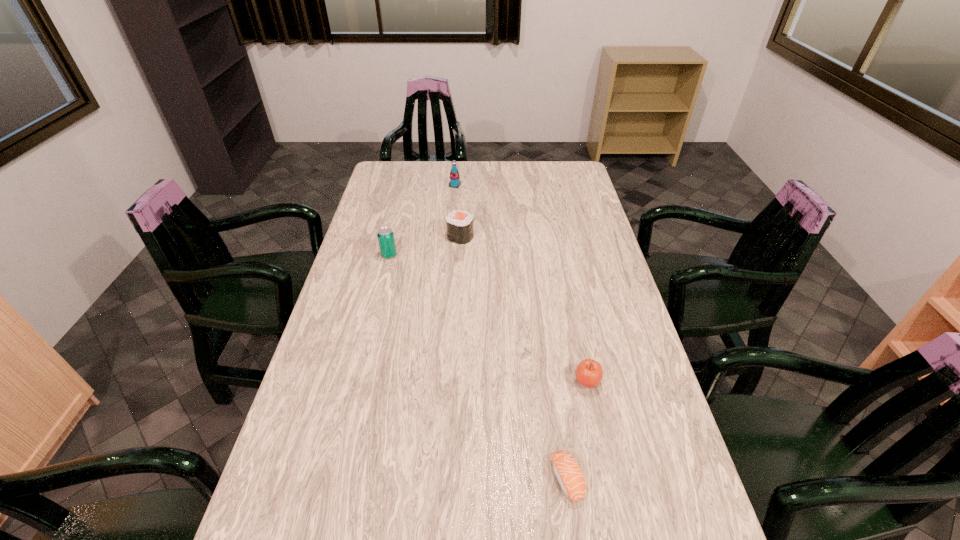
Locate an element on the screen. The width and height of the screenshot is (960, 540). soda is located at coordinates (454, 182).

Where is `the third nearest object`? the third nearest object is located at coordinates (385, 235).

I want to click on beer can, so point(385,235).

You are a GUI agent. You are given a task and a screenshot of the screen. Output one action in this format:
    pyautogui.click(x=<x>, y=<y>)
    Task: Click on the taller sushi
    The height and width of the screenshot is (540, 960).
    Given the screenshot: What is the action you would take?
    pyautogui.click(x=459, y=224)

The image size is (960, 540). Find the location of `the fourth nearest object`. the fourth nearest object is located at coordinates (459, 224).

Find the location of a particular element. the second nearest object is located at coordinates (589, 373).

At what (x,y) coordinates should I click in order to perform the action: click on the rightmost object. Please return your answer as a coordinate pair (x, y). This screenshot has height=540, width=960. Looking at the image, I should click on (589, 373).

This screenshot has width=960, height=540. What are the coordinates of `the nearer sushi` in the screenshot? It's located at (569, 475).

This screenshot has width=960, height=540. I want to click on the shorter sushi, so click(569, 475).

Identify the location of vacant space located on the front of the farthest object. Image resolution: width=960 pixels, height=540 pixels. (452, 223).